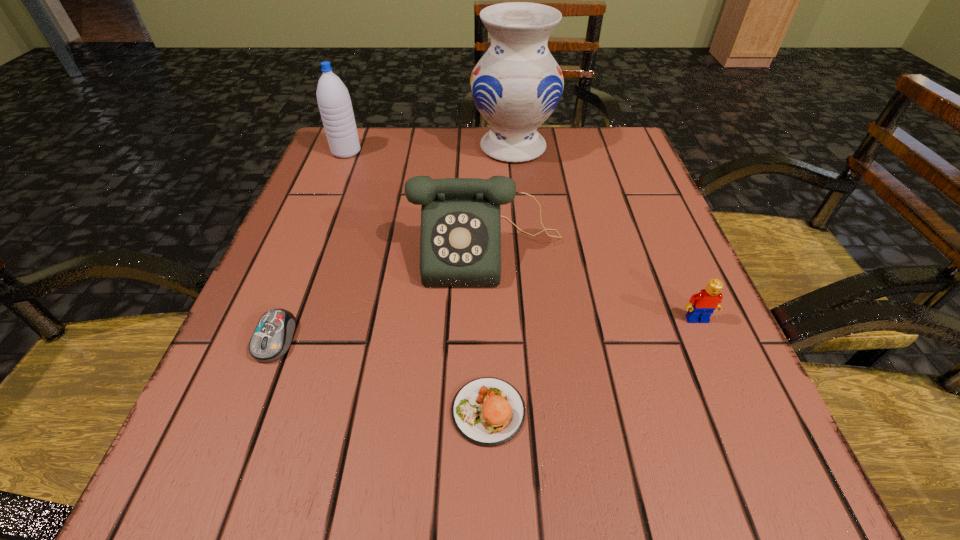
You are a GUI agent. You are given a task and a screenshot of the screen. Output one action in this format:
    pyautogui.click(x=<x>, y=<y>)
    Task: Click on the blank area located on the dial of the third farthest object
    
    Given the screenshot: What is the action you would take?
    pyautogui.click(x=490, y=336)

Locate an element on the screen. This screenshot has height=540, width=960. vacant space located on the front-facing side of the fourth tallest object is located at coordinates (754, 450).

You are a GUI agent. You are given a task and a screenshot of the screen. Output one action in this format:
    pyautogui.click(x=<x>, y=<y>)
    Task: Click on the vacant area situated on the right of the nearest object
    The height and width of the screenshot is (540, 960).
    Given the screenshot: What is the action you would take?
    coord(674,411)

Locate an element on the screen. vacant region located 0.080m on the wheel side of the computer mouse is located at coordinates (246, 415).

Find the location of a particular element. vase that is at the far edge is located at coordinates coord(516,85).

This screenshot has width=960, height=540. I want to click on water bottle situated at the far edge, so click(x=333, y=98).

Find the location of a particular element. Image resolution: width=960 pixels, height=540 pixels. object that is at the near edge is located at coordinates (487, 411).

I want to click on water bottle positioned at the left edge, so click(333, 98).

Image resolution: width=960 pixels, height=540 pixels. In order to click on computer mouse at the left edge in this screenshot , I will do `click(272, 337)`.

At what (x,y) coordinates should I click in order to perform the action: click on object located in the right edge section of the desktop. Please return your answer as a coordinate pair (x, y). This screenshot has height=540, width=960. Looking at the image, I should click on (701, 305).